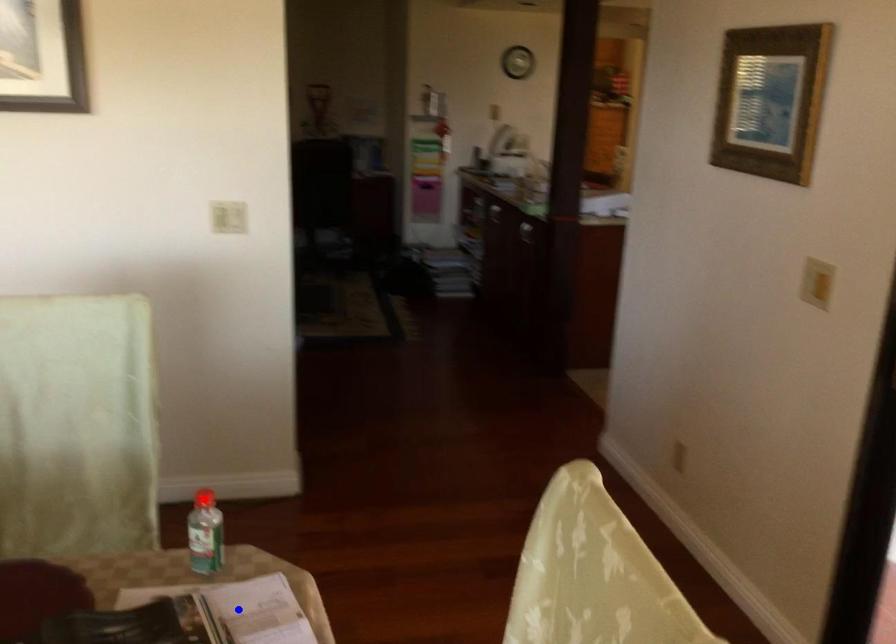
Question: In the image, two points are highlighted. Which point is nearer to the camera? Reply with the corresponding letter.

Choices:
 (A) blue point
 (B) red point

Answer: (A)